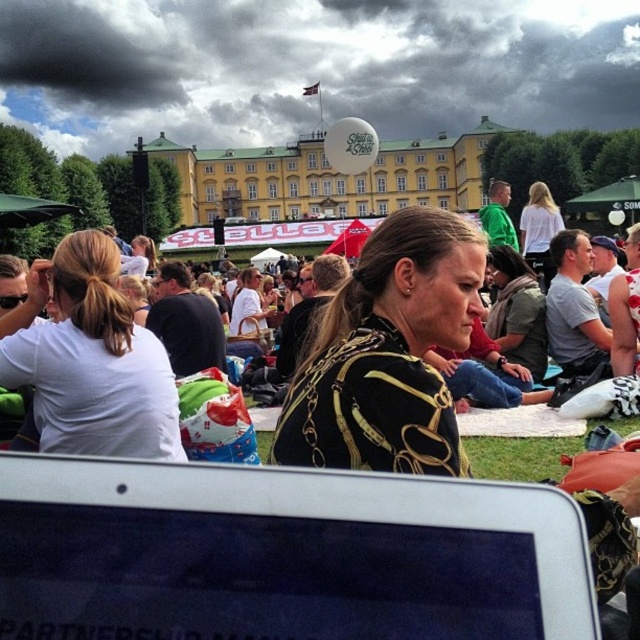
You are a photographer at the festival and want to capture both the white matte shirt at center and the white matte shirt at upper right in your shot. Which shirt should you focus on first if you want to ensure both are in frame without moving the camera?

The white matte shirt at center is smaller in size than the white matte shirt at upper right. To ensure both are in frame, focus on the larger white matte shirt at upper right first, then adjust the camera angle slightly to include the smaller one at center.

You are a photographer at the festival scene. You need to capture a photo that includes both the silver metallic tablet at lower center and the black textured jacket at center. Based on their positions, which object should you place on the left side of the photo frame?

The silver metallic tablet at lower center should be placed on the left side of the photo frame because it is positioned to the left of the black textured jacket at center.

You are standing at the edge of the crowd in the festival scene. You see the white matte shirt at center. If you want to reach it in 10 seconds, what is the minimum speed you need to walk at?

The distance between you and the white matte shirt at center is 71.66 meters. To cover this distance in 10 seconds, you would need to walk at a speed of 7.166 meters per second.